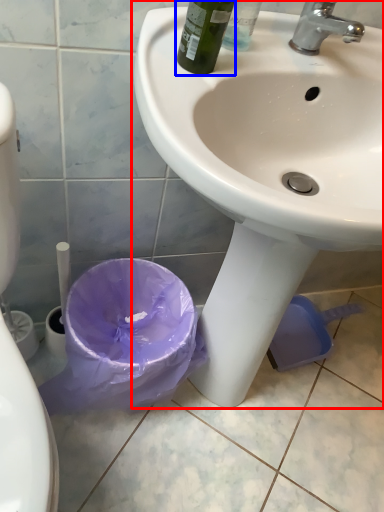
Question: Which object appears farthest to the camera in this image, sink (highlighted by a red box) or bottle (highlighted by a blue box)?

Choices:
 (A) sink
 (B) bottle

Answer: (B)